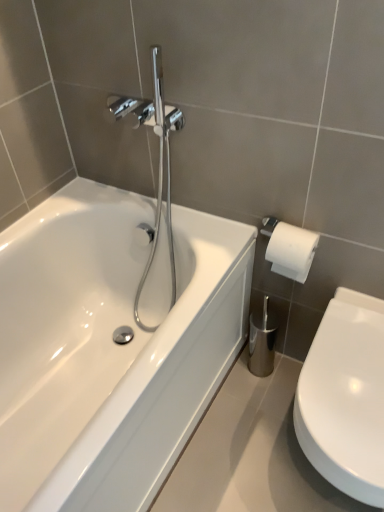
This screenshot has width=384, height=512. Identify the location of free space above white glossy toilet at lower right (from a real-world perspective). pyautogui.click(x=348, y=380).